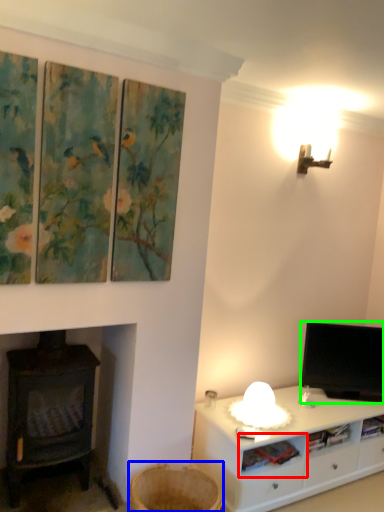
Question: Considering the real-world distances, which object is farthest from shelf (highlighted by a red box)? basket (highlighted by a blue box) or television (highlighted by a green box)?

Choices:
 (A) basket
 (B) television

Answer: (B)